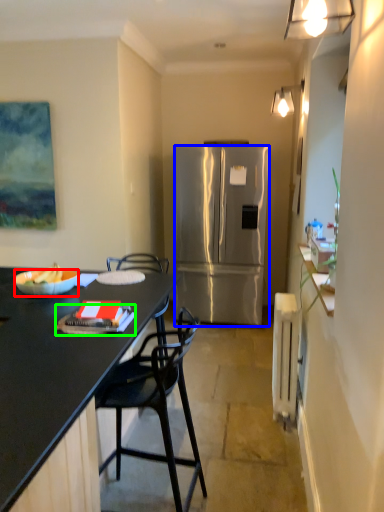
Question: Which object is positioned farthest from bowl (highlighted by a red box)? Select from refrigerator (highlighted by a blue box) and book (highlighted by a green box).

Choices:
 (A) refrigerator
 (B) book

Answer: (A)